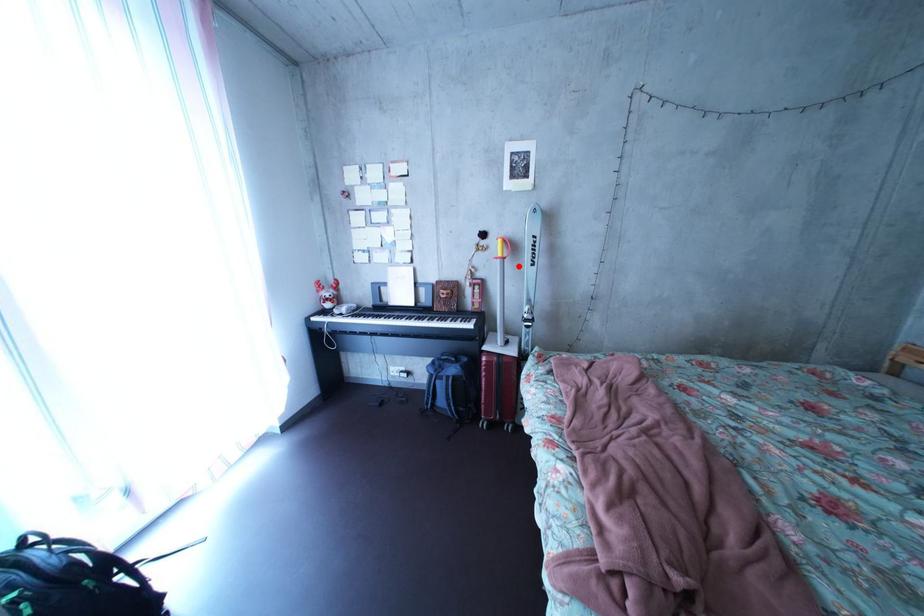
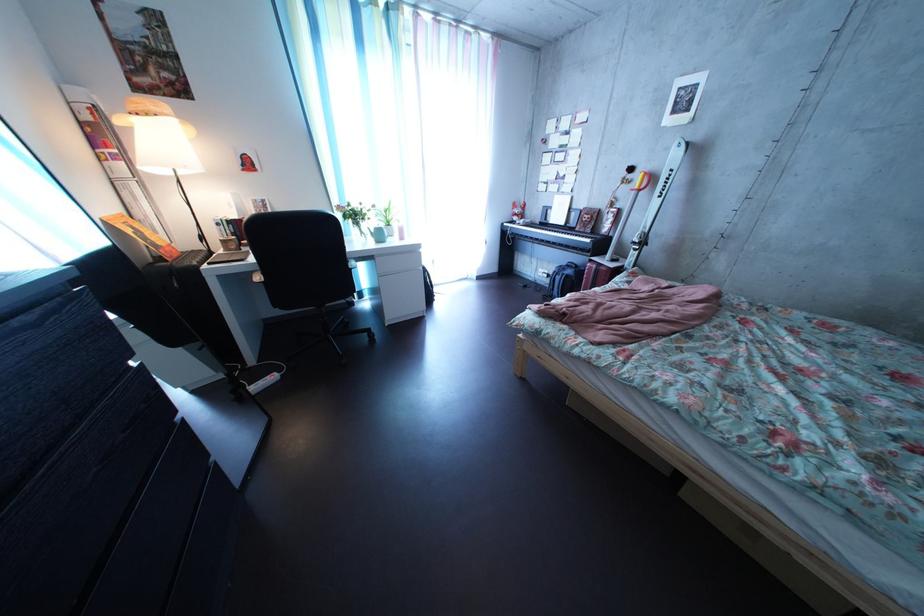
Question: I am providing you with two images of the same scene from different viewpoints. Given a red point in image1, look at the same physical point in image2. Is it:

Choices:
 (A) Closer to the viewpoint
 (B) Farther from the viewpoint

Answer: (A)